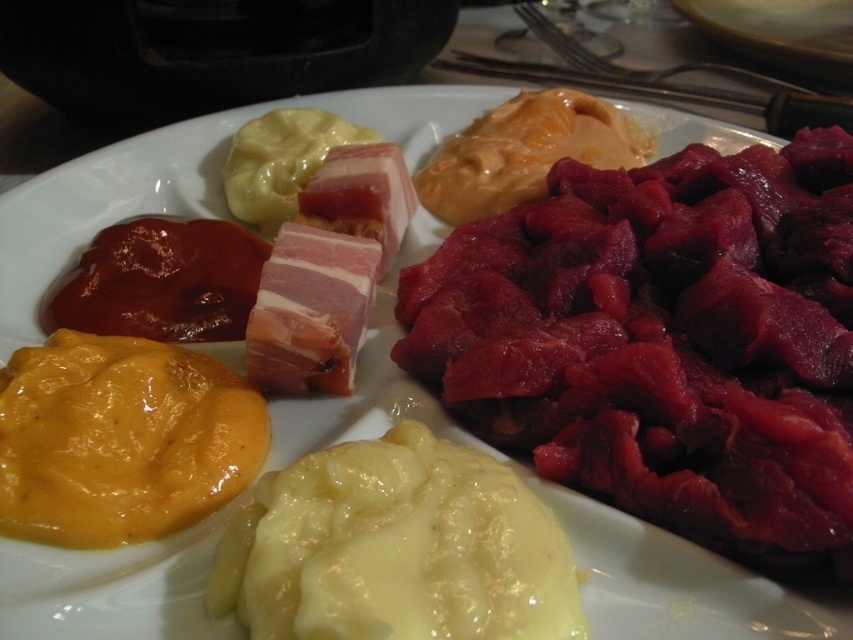
Can you confirm if yellow creamy cheese at lower left is positioned to the left of shiny red sauce at upper left?

Incorrect, yellow creamy cheese at lower left is not on the left side of shiny red sauce at upper left.

Does yellow creamy cheese at lower left have a larger size compared to shiny red sauce at upper left?

Correct, yellow creamy cheese at lower left is larger in size than shiny red sauce at upper left.

What do you see at coordinates (120, 440) in the screenshot?
I see `yellow creamy cheese at lower left` at bounding box center [120, 440].

The image size is (853, 640). I want to click on yellow creamy cheese at lower left, so click(120, 440).